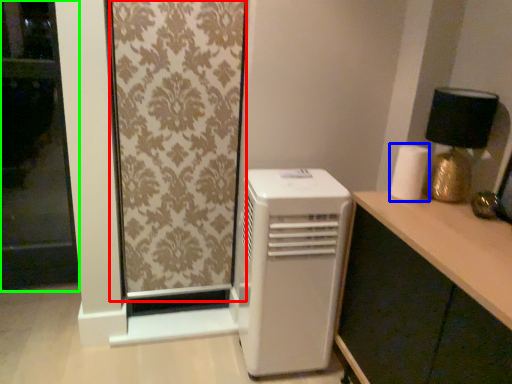
Question: Based on their relative distances, which object is farther from curtain (highlighted by a red box)? Choose from paper towel (highlighted by a blue box) and screen door (highlighted by a green box).

Choices:
 (A) paper towel
 (B) screen door

Answer: (B)